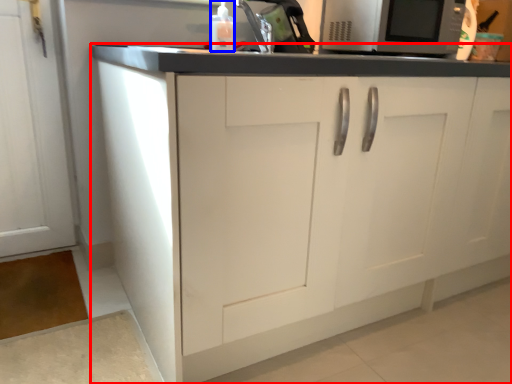
Question: Which object is further to the camera taking this photo, cabinetry (highlighted by a red box) or bottle (highlighted by a blue box)?

Choices:
 (A) cabinetry
 (B) bottle

Answer: (B)